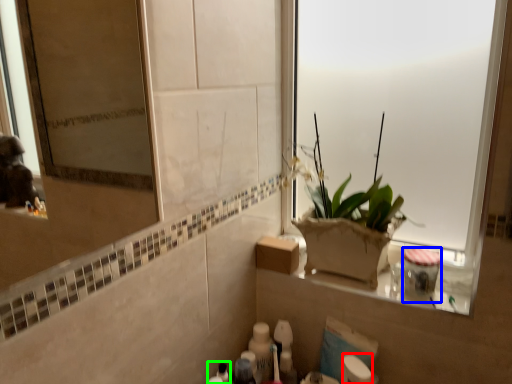
Question: Which is farther away from toilet paper (highlighted by a red box)? toiletry (highlighted by a blue box) or toiletry (highlighted by a green box)?

Choices:
 (A) toiletry
 (B) toiletry

Answer: (B)